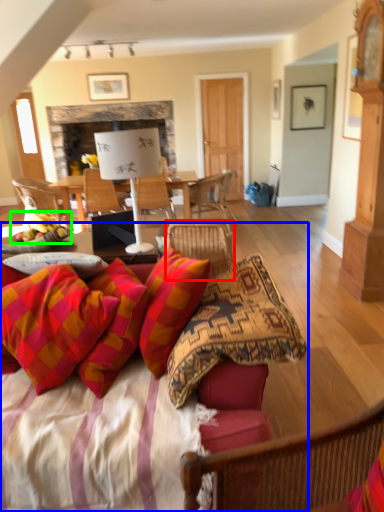
Question: Which is nearer to the chair (highlighted by a red box)? studio couch (highlighted by a blue box) or fruit (highlighted by a green box).

Choices:
 (A) studio couch
 (B) fruit

Answer: (B)